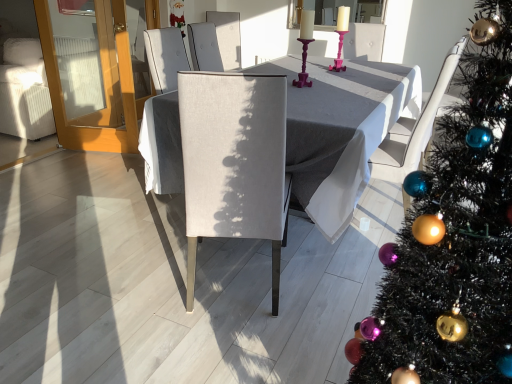
Image resolution: width=512 pixels, height=384 pixels. I want to click on free space to the left of matte gray chair at center, so (x=130, y=292).